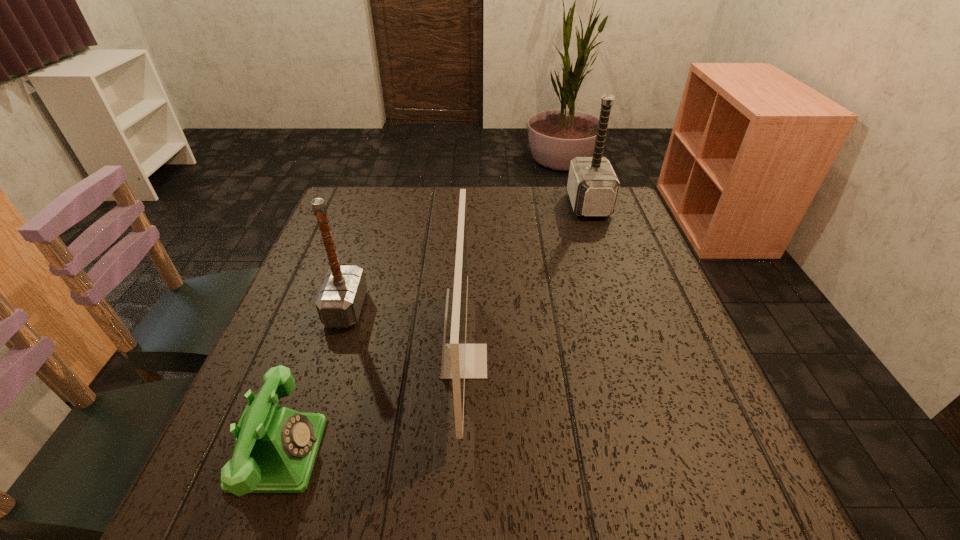
Identify the location of vacant space at the near edge of the desktop. This screenshot has height=540, width=960. (575, 486).

In order to click on vacant space at the left edge of the desktop in this screenshot , I will do `click(353, 249)`.

The image size is (960, 540). Find the location of `free space at the right edge of the desktop`. free space at the right edge of the desktop is located at coordinates [699, 364].

Locate an element on the screen. vacant space at the near right corner of the desktop is located at coordinates (732, 496).

Find the location of a particular element. free space between the telephone and the nearer hammer is located at coordinates (313, 380).

You are a GUI agent. You are given a task and a screenshot of the screen. Output one action in this format:
    pyautogui.click(x=<x>, y=<y>)
    Task: Click on the vacant area between the right hammer and the shortest object
    Image resolution: width=960 pixels, height=540 pixels.
    Given the screenshot: What is the action you would take?
    pyautogui.click(x=434, y=328)

Where is `free space between the left hammer and the monitor`? The width and height of the screenshot is (960, 540). free space between the left hammer and the monitor is located at coordinates (405, 335).

Identify the location of vacant area that lies between the left hammer and the monitor. (405, 335).

This screenshot has width=960, height=540. I want to click on free spot between the shortest object and the left hammer, so click(x=313, y=380).

The width and height of the screenshot is (960, 540). Identify the location of free area in between the left hammer and the shortest object. (313, 380).